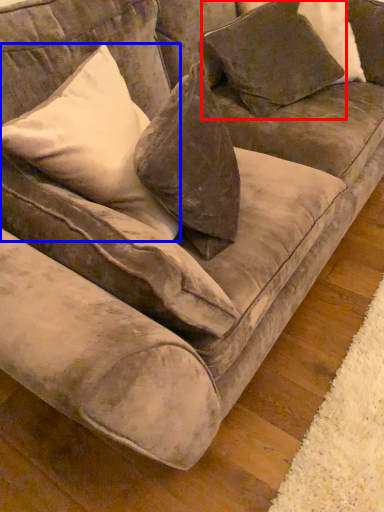
Question: Which of the following is the closest to the observer, pillow (highlighted by a red box) or pillow (highlighted by a blue box)?

Choices:
 (A) pillow
 (B) pillow

Answer: (B)